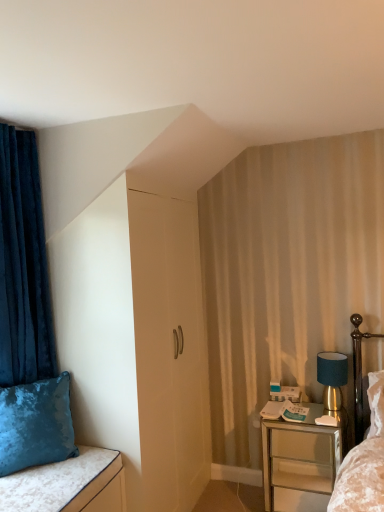
The width and height of the screenshot is (384, 512). Describe the element at coordinates (52, 482) in the screenshot. I see `velvet cushion at lower left` at that location.

What do you see at coordinates (23, 265) in the screenshot?
I see `velvet blue curtain at left` at bounding box center [23, 265].

The image size is (384, 512). I want to click on velvet cushion at lower left, so click(x=52, y=482).

Is point (62, 446) positioned after point (292, 478)?

No, it is in front of (292, 478).

From the image's perspective, which object appears higher, velvet blue pillow at lower left or metallic silver nightstand at lower right?

velvet blue pillow at lower left appears higher in the image.

Where is `nightstand on the right of the velvet blue pillow at lower left`? nightstand on the right of the velvet blue pillow at lower left is located at coordinates (300, 462).

Between velvet blue pillow at lower left and metallic silver nightstand at lower right, which one has more height?

metallic silver nightstand at lower right is taller.

Is point (3, 422) closer or farther from the camera than point (342, 367)?

Point (3, 422) is positioned closer to the camera compared to point (342, 367).

Identify the location of bedside lamp lying behind the velvet blue pillow at lower left. Image resolution: width=384 pixels, height=512 pixels. (332, 377).

Does velvet blue pillow at lower left have a smaller size compared to teal fabric lampshade at right?

No, velvet blue pillow at lower left is not smaller than teal fabric lampshade at right.

Is teal fabric lampshade at right a part of velvet cushion at lower left?

No, teal fabric lampshade at right is not inside velvet cushion at lower left.

Which is more to the left, velvet cushion at lower left or teal fabric lampshade at right?

velvet cushion at lower left.

Is velvet cushion at lower left facing away from teal fabric lampshade at right?

No, velvet cushion at lower left is not facing away from teal fabric lampshade at right.

From a real-world perspective, is velvet blue pillow at lower left physically below velvet blue curtain at left?

Yes.

In the scene shown: Can velvet blue curtain at left be found inside velvet blue pillow at lower left?

No, velvet blue curtain at left is not a part of velvet blue pillow at lower left.

Can you tell me how much velvet blue pillow at lower left and velvet blue curtain at left differ in facing direction?

velvet blue pillow at lower left and velvet blue curtain at left are facing 33.6 degrees away from each other.

Between velvet blue pillow at lower left and velvet blue curtain at left, which one is positioned behind?

velvet blue curtain at left is behind.

Is there a large distance between metallic silver nightstand at lower right and teal fabric lampshade at right?

No, metallic silver nightstand at lower right is in close proximity to teal fabric lampshade at right.

Considering the relative sizes of metallic silver nightstand at lower right and teal fabric lampshade at right in the image provided, is metallic silver nightstand at lower right wider than teal fabric lampshade at right?

Yes, metallic silver nightstand at lower right is wider than teal fabric lampshade at right.

In the scene shown: Can you tell me how much metallic silver nightstand at lower right and teal fabric lampshade at right differ in facing direction?

There is a 2.31e-05-degree angle between the facing directions of metallic silver nightstand at lower right and teal fabric lampshade at right.

From the image's perspective, is metallic silver nightstand at lower right above or below teal fabric lampshade at right?

metallic silver nightstand at lower right is situated lower than teal fabric lampshade at right in the image.

Where is `pillow above the velvet cushion at lower left (from the image's perspective)`? The image size is (384, 512). pillow above the velvet cushion at lower left (from the image's perspective) is located at coordinates (36, 424).

From a real-world perspective, which object stands above the other?

velvet blue pillow at lower left, from a real-world perspective.

Is velvet blue pillow at lower left to the right of velvet cushion at lower left from the viewer's perspective?

Incorrect, velvet blue pillow at lower left is not on the right side of velvet cushion at lower left.

Considering the relative sizes of velvet blue pillow at lower left and velvet cushion at lower left in the image provided, is velvet blue pillow at lower left thinner than velvet cushion at lower left?

Yes.

In terms of size, does teal fabric lampshade at right appear bigger or smaller than velvet blue pillow at lower left?

Considering their sizes, teal fabric lampshade at right takes up less space than velvet blue pillow at lower left.

Is point (333, 365) closer or farther from the camera than point (2, 420)?

Point (333, 365).

Considering the positions of objects teal fabric lampshade at right and velvet blue pillow at lower left in the image provided, who is behind, teal fabric lampshade at right or velvet blue pillow at lower left?

teal fabric lampshade at right.

Image resolution: width=384 pixels, height=512 pixels. In order to click on pillow in front of the teal fabric lampshade at right in this screenshot , I will do `click(36, 424)`.

Where is `nightstand below the velvet blue pillow at lower left (from a real-world perspective)`? This screenshot has height=512, width=384. nightstand below the velvet blue pillow at lower left (from a real-world perspective) is located at coordinates (300, 462).

Locate an element on the screen. This screenshot has height=512, width=384. bedside lamp behind the velvet blue pillow at lower left is located at coordinates (332, 377).

Looking at this image, looking at the image, which one is located closer to velvet cushion at lower left, velvet blue pillow at lower left or metallic silver nightstand at lower right?

velvet blue pillow at lower left.

Looking at the image, which one is located further to velvet blue curtain at left, velvet cushion at lower left or metallic silver nightstand at lower right?

Among the two, metallic silver nightstand at lower right is located further to velvet blue curtain at left.

Looking at the image, which one is located further to velvet cushion at lower left, metallic silver nightstand at lower right or velvet blue curtain at left?

Based on the image, metallic silver nightstand at lower right appears to be further to velvet cushion at lower left.

From the image, which object appears to be farther from metallic silver nightstand at lower right, velvet cushion at lower left or velvet blue curtain at left?

velvet blue curtain at left lies further to metallic silver nightstand at lower right than the other object.

Considering their positions, is metallic silver nightstand at lower right positioned further to velvet cushion at lower left than teal fabric lampshade at right?

Among the two, teal fabric lampshade at right is located further to velvet cushion at lower left.

When comparing their distances from velvet blue curtain at left, does teal fabric lampshade at right or metallic silver nightstand at lower right seem further?

teal fabric lampshade at right.

Which object lies nearer to the anchor point velvet cushion at lower left, metallic silver nightstand at lower right or velvet blue pillow at lower left?

Among the two, velvet blue pillow at lower left is located nearer to velvet cushion at lower left.

Considering their positions, is velvet blue curtain at left positioned closer to velvet cushion at lower left than teal fabric lampshade at right?

velvet blue curtain at left.

Locate an element on the screen. The height and width of the screenshot is (512, 384). vanity between velvet blue pillow at lower left and teal fabric lampshade at right in the horizontal direction is located at coordinates (52, 482).

Locate an element on the screen. pillow located between velvet blue curtain at left and metallic silver nightstand at lower right in the left-right direction is located at coordinates (36, 424).

Where is `nightstand situated between velvet cushion at lower left and teal fabric lampshade at right from left to right`? This screenshot has width=384, height=512. nightstand situated between velvet cushion at lower left and teal fabric lampshade at right from left to right is located at coordinates click(300, 462).

Find the location of `pillow between velvet blue curtain at left and velvet cushion at lower left in the vertical direction`. pillow between velvet blue curtain at left and velvet cushion at lower left in the vertical direction is located at coordinates 36,424.